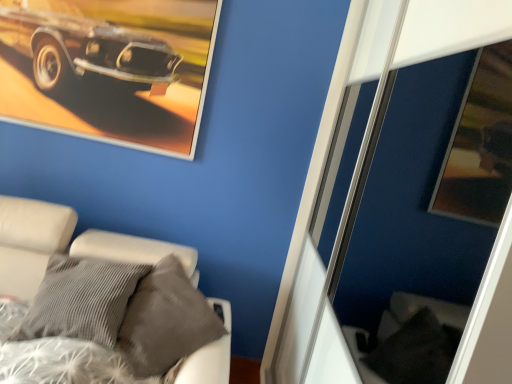
Describe the element at coordinates (30, 242) in the screenshot. The image size is (512, 384). I see `white fabric bed at lower left` at that location.

The height and width of the screenshot is (384, 512). Identify the location of white fabric bed at lower left. (30, 242).

At what (x,y) coordinates should I click in order to perform the action: click on metallic silver picture frame at upper left. Please return your answer as a coordinate pair (x, y). Looking at the image, I should click on (109, 69).

Describe the element at coordinates (109, 69) in the screenshot. The height and width of the screenshot is (384, 512). I see `metallic silver picture frame at upper left` at that location.

What are the coordinates of `white fabric bed at lower left` in the screenshot? It's located at (30, 242).

In the scene shown: Is metallic silver picture frame at upper left to the left of white fabric bed at lower left from the viewer's perspective?

Indeed, metallic silver picture frame at upper left is positioned on the left side of white fabric bed at lower left.

Is metallic silver picture frame at upper left behind white fabric bed at lower left?

Yes, metallic silver picture frame at upper left is further from the viewer.

Does point (185, 89) come behind point (4, 291)?

Yes, it is.

From the image's perspective, is metallic silver picture frame at upper left located above or below white fabric bed at lower left?

metallic silver picture frame at upper left is above white fabric bed at lower left.

From a real-world perspective, is metallic silver picture frame at upper left positioned over white fabric bed at lower left based on gravity?

Yes, from a real-world perspective, metallic silver picture frame at upper left is above white fabric bed at lower left.

Between metallic silver picture frame at upper left and white fabric bed at lower left, which one has smaller width?

With smaller width is metallic silver picture frame at upper left.

Which of these two, metallic silver picture frame at upper left or white fabric bed at lower left, stands taller?

white fabric bed at lower left is taller.

Between metallic silver picture frame at upper left and white fabric bed at lower left, which one has larger size?

white fabric bed at lower left is bigger.

Is metallic silver picture frame at upper left outside of white fabric bed at lower left?

Yes, metallic silver picture frame at upper left is not within white fabric bed at lower left.

Is metallic silver picture frame at upper left not close to white fabric bed at lower left?

They are positioned close to each other.

Is metallic silver picture frame at upper left aimed at white fabric bed at lower left?

No, metallic silver picture frame at upper left is not facing towards white fabric bed at lower left.

How different are the orientations of metallic silver picture frame at upper left and white fabric bed at lower left in degrees?

0.565 degrees.

Measure the distance between metallic silver picture frame at upper left and white fabric bed at lower left.

metallic silver picture frame at upper left and white fabric bed at lower left are 28.85 inches apart from each other.

You are a GUI agent. You are given a task and a screenshot of the screen. Output one action in this format:
    pyautogui.click(x=<x>, y=<y>)
    Task: Click on the picture frame that is on the left side of white fabric bed at lower left
    The width and height of the screenshot is (512, 384).
    Given the screenshot: What is the action you would take?
    pyautogui.click(x=109, y=69)

Can you confirm if white fabric bed at lower left is positioned to the left of metallic silver picture frame at upper left?

In fact, white fabric bed at lower left is to the right of metallic silver picture frame at upper left.

Relative to metallic silver picture frame at upper left, is white fabric bed at lower left in front or behind?

white fabric bed at lower left is positioned closer to the viewer than metallic silver picture frame at upper left.

Which is less distant, (116, 251) or (110, 66)?

Positioned in front is point (116, 251).

From the image's perspective, is white fabric bed at lower left above or below metallic silver picture frame at upper left?

white fabric bed at lower left is situated lower than metallic silver picture frame at upper left in the image.

From a real-world perspective, is white fabric bed at lower left on top of metallic silver picture frame at upper left?

Actually, white fabric bed at lower left is physically below metallic silver picture frame at upper left in the real world.

Does white fabric bed at lower left have a lesser width compared to metallic silver picture frame at upper left?

Incorrect, the width of white fabric bed at lower left is not less than that of metallic silver picture frame at upper left.

Is white fabric bed at lower left taller than metallic silver picture frame at upper left?

Indeed, white fabric bed at lower left has a greater height compared to metallic silver picture frame at upper left.

Considering the relative sizes of white fabric bed at lower left and metallic silver picture frame at upper left in the image provided, is white fabric bed at lower left smaller than metallic silver picture frame at upper left?

Incorrect, white fabric bed at lower left is not smaller in size than metallic silver picture frame at upper left.

Is metallic silver picture frame at upper left surrounded by white fabric bed at lower left?

No.

Is white fabric bed at lower left with metallic silver picture frame at upper left?

No, white fabric bed at lower left is not beside metallic silver picture frame at upper left.

Could you tell me if white fabric bed at lower left is facing metallic silver picture frame at upper left?

No, white fabric bed at lower left is not facing towards metallic silver picture frame at upper left.

How different are the orientations of white fabric bed at lower left and metallic silver picture frame at upper left in degrees?

The facing directions of white fabric bed at lower left and metallic silver picture frame at upper left are 0.565 degrees apart.

This screenshot has height=384, width=512. I want to click on furniture in front of the metallic silver picture frame at upper left, so click(30, 242).

Locate an element on the screen. The height and width of the screenshot is (384, 512). furniture that appears below the metallic silver picture frame at upper left (from a real-world perspective) is located at coordinates (30, 242).

Where is `furniture that is on the right side of metallic silver picture frame at upper left`? furniture that is on the right side of metallic silver picture frame at upper left is located at coordinates (30, 242).